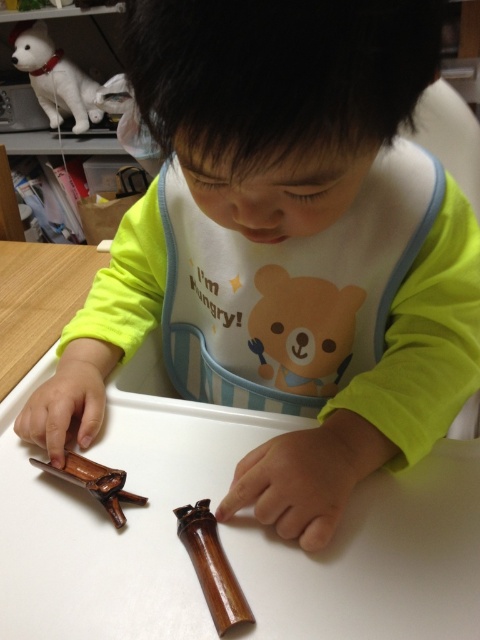
Question: Considering the relative positions of brown polished wooden stick at center and brown wooden stick at lower left in the image provided, where is brown polished wooden stick at center located with respect to brown wooden stick at lower left?

Choices:
 (A) below
 (B) above

Answer: (A)

Question: Which point is farther to the camera?

Choices:
 (A) (172, 576)
 (B) (311, 355)
 (C) (187, 506)
 (D) (406, 227)

Answer: (B)

Question: Which object is farther from the camera taking this photo?

Choices:
 (A) brown wooden stick at lower left
 (B) brown wood table at center

Answer: (A)

Question: Is white cotton bib at center further to the viewer compared to brown matte bear at center?

Choices:
 (A) yes
 (B) no

Answer: (B)

Question: Which object is positioned farthest from the white glossy dog at upper left?

Choices:
 (A) brown wood table at center
 (B) brown polished wooden stick at center
 (C) brown wooden stick at lower left
 (D) brown matte bear at center

Answer: (B)

Question: Can you confirm if white cotton bib at center is bigger than brown matte bear at center?

Choices:
 (A) no
 (B) yes

Answer: (B)